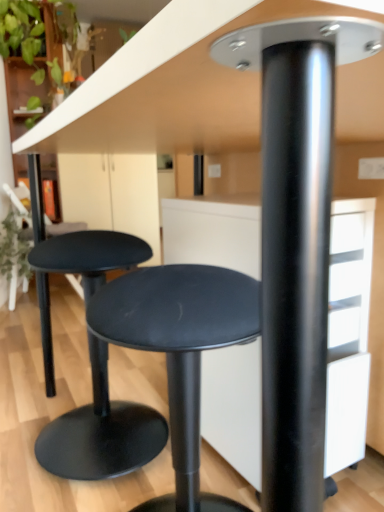
Question: Is matte black stool at lower left, positioned as the second stool in front-to-back order, bigger or smaller than matte black stool at center, the first stool when ordered from front to back?

Choices:
 (A) big
 (B) small

Answer: (A)

Question: Relative to matte black stool at center, which is the 2th stool from back to front, is matte black stool at lower left, which appears as the first stool when viewed from the back, in front or behind?

Choices:
 (A) behind
 (B) front

Answer: (A)

Question: From their relative heights in the image, would you say matte black stool at lower left, which appears as the first stool when viewed from the back, is taller or shorter than matte black stool at center, the first stool when ordered from front to back?

Choices:
 (A) short
 (B) tall

Answer: (B)

Question: From a real-world perspective, is matte black stool at center, which is the 2th stool from back to front, positioned above or below matte black stool at lower left, positioned as the second stool in front-to-back order?

Choices:
 (A) below
 (B) above

Answer: (A)

Question: Is matte black stool at center, the first stool when ordered from front to back, to the left or to the right of matte black stool at lower left, positioned as the second stool in front-to-back order, in the image?

Choices:
 (A) left
 (B) right

Answer: (B)

Question: Considering the positions of matte black stool at center, the first stool when ordered from front to back, and matte black stool at lower left, positioned as the second stool in front-to-back order, in the image, is matte black stool at center, the first stool when ordered from front to back, bigger or smaller than matte black stool at lower left, positioned as the second stool in front-to-back order,?

Choices:
 (A) small
 (B) big

Answer: (A)

Question: Is matte black stool at center, which is the 2th stool from back to front, wider or thinner than matte black stool at lower left, which appears as the first stool when viewed from the back?

Choices:
 (A) thin
 (B) wide

Answer: (B)